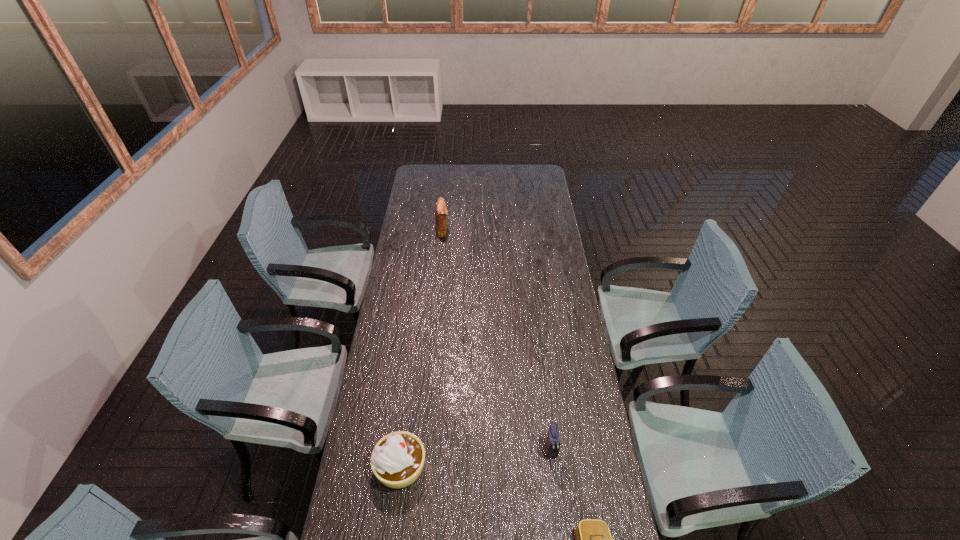
Identify the location of the farthest clutch bag. The image size is (960, 540). (441, 212).

Image resolution: width=960 pixels, height=540 pixels. Find the location of `the farthest object`. the farthest object is located at coordinates (441, 212).

At what (x,y) coordinates should I click in order to perform the action: click on the second shortest clutch bag. Please return your answer as a coordinate pair (x, y). Looking at the image, I should click on (552, 445).

I want to click on the second farthest clutch bag, so click(552, 445).

Where is `whipped cream`? The height and width of the screenshot is (540, 960). whipped cream is located at coordinates (397, 460).

Where is `free spot located on the open side of the farthest clutch bag`? free spot located on the open side of the farthest clutch bag is located at coordinates (494, 230).

This screenshot has height=540, width=960. I want to click on blank space located with the zip open on the third object from left to right, so click(559, 523).

Locate an element on the screen. This screenshot has height=540, width=960. vacant space located on the back of the whipped cream is located at coordinates (416, 349).

Locate an element on the screen. object at the left edge is located at coordinates (397, 460).

Locate an element on the screen. vacant region at the far edge of the desktop is located at coordinates (439, 183).